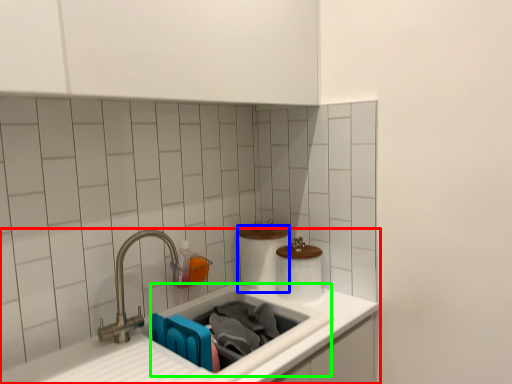
Question: Estimate the real-world distances between objects in this image. Which object is closer to sink (highlighted by a red box), toilet paper (highlighted by a blue box) or sink (highlighted by a green box)?

Choices:
 (A) toilet paper
 (B) sink

Answer: (B)